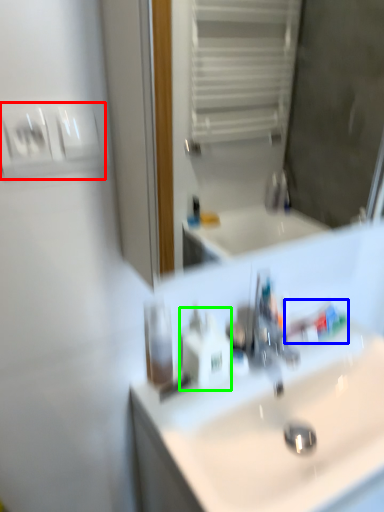
Question: Considering the real-world distances, which object is closest to light switch (highlighted by a red box)? toothpaste (highlighted by a blue box) or soap dispenser (highlighted by a green box).

Choices:
 (A) toothpaste
 (B) soap dispenser

Answer: (B)